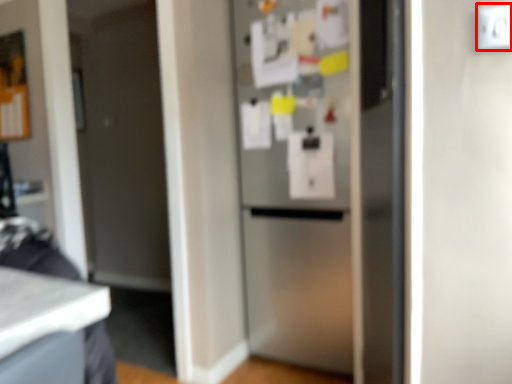
Question: Where is electric outlet (annotated by the red box) located in relation to refrigerator in the image?

Choices:
 (A) left
 (B) right

Answer: (B)